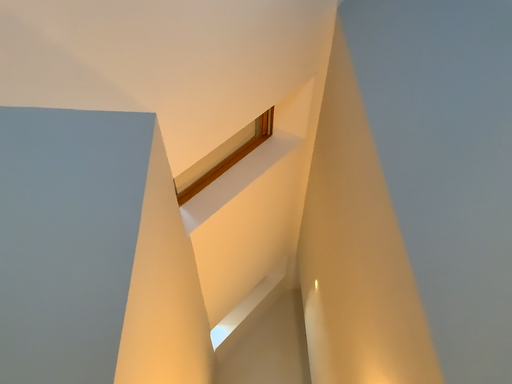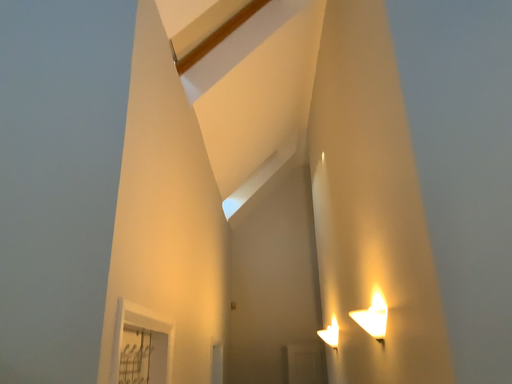
Question: How did the camera likely rotate when shooting the video?

Choices:
 (A) rotated upward
 (B) rotated downward

Answer: (B)